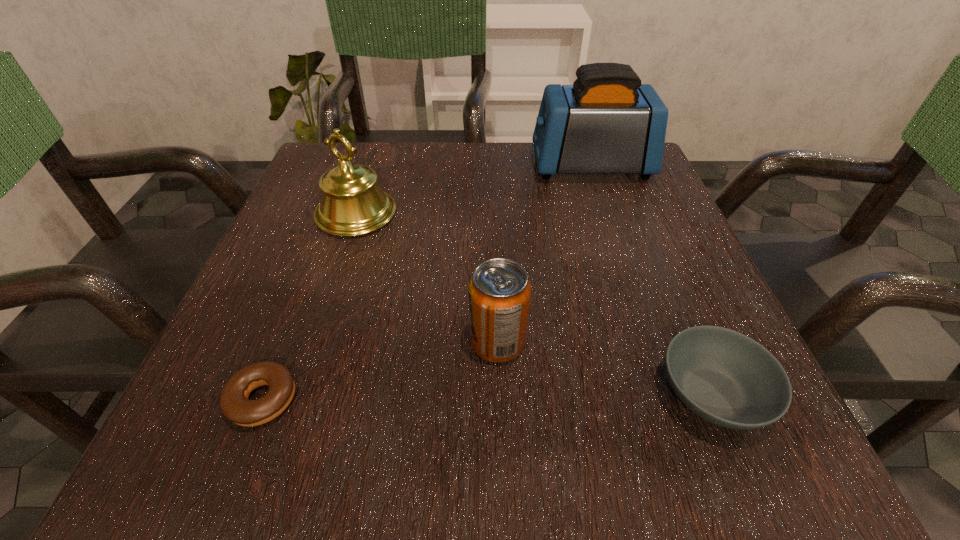
Where is `free space between the third shortest object and the farthest object`? This screenshot has width=960, height=540. free space between the third shortest object and the farthest object is located at coordinates 544,254.

Where is `empty location between the fourth tallest object and the shortest object`? empty location between the fourth tallest object and the shortest object is located at coordinates (487, 397).

I want to click on empty space between the fourth tallest object and the shortest object, so click(x=487, y=397).

Where is `free spot between the second farthest object and the shortest object`? The width and height of the screenshot is (960, 540). free spot between the second farthest object and the shortest object is located at coordinates (309, 307).

Select which object appears as the second closest to the third tallest object. Please provide its 2D coordinates. Your answer should be formatted as a tuple, i.e. [(x, y)], where the tuple contains the x and y coordinates of a point satisfying the conditions above.

[(234, 403)]

Where is `the third closest object to the third object from left to right`? Image resolution: width=960 pixels, height=540 pixels. the third closest object to the third object from left to right is located at coordinates (352, 204).

What are the coordinates of `vacant region that satisfies the following two spatial constraints: 1. on the back side of the second shortest object; 2. on the left side of the doughnut` in the screenshot? It's located at (265, 394).

Find the location of `blank space that satisfies the following two spatial constraints: 1. on the back side of the second shortest object; 2. on the front-facing side of the tallest object`. blank space that satisfies the following two spatial constraints: 1. on the back side of the second shortest object; 2. on the front-facing side of the tallest object is located at coordinates (617, 166).

You are a GUI agent. You are given a task and a screenshot of the screen. Output one action in this format:
    pyautogui.click(x=<x>, y=<y>)
    Task: Click on the free location that satisfies the following two spatial constraints: 1. on the front-facing side of the second shortest object; 2. on the right side of the farthest object
    This screenshot has height=540, width=960.
    Given the screenshot: What is the action you would take?
    pos(667,394)